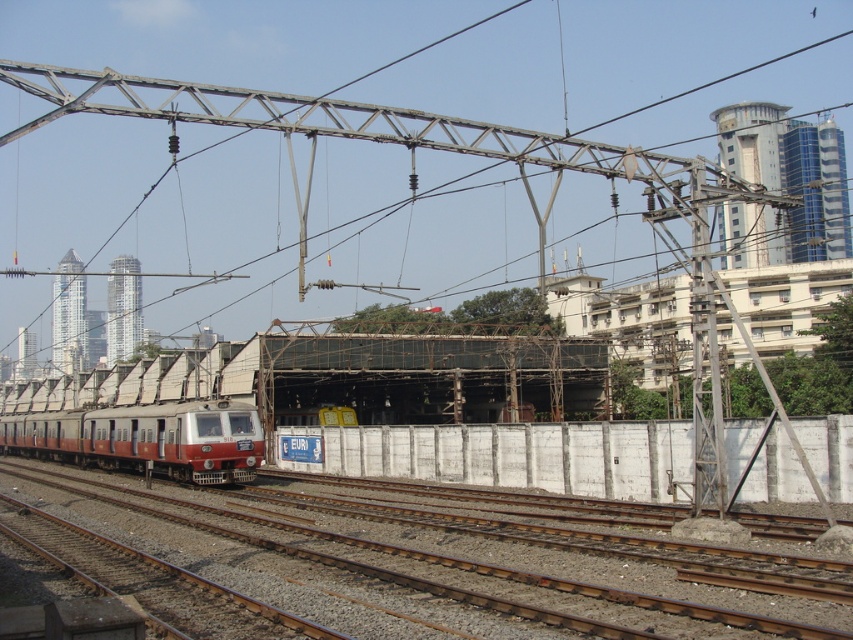
You are a railway engineer inspecting the tracks. You notice the brown gravel train track at center and the red matte train at lower left. Which object has a smaller width?

The brown gravel train track at center is thinner than the red matte train at lower left, so the brown gravel train track at center has a smaller width.

You are a maintenance worker inspecting the railway. You notice the brown gravel train track at center and the red matte train at lower left. Which object is lower in height?

The brown gravel train track at center has a lesser height compared to the red matte train at lower left, so the brown gravel train track at center is lower in height.